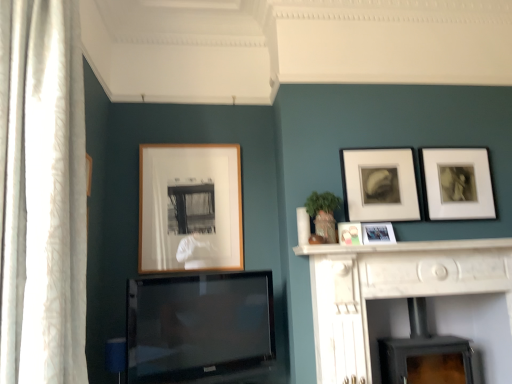
Locate an element on the screen. This screenshot has height=384, width=512. vacant region above wooden frame at center, positioned as the fifth picture frame in right-to-left order (from a real-world perspective) is located at coordinates point(187,142).